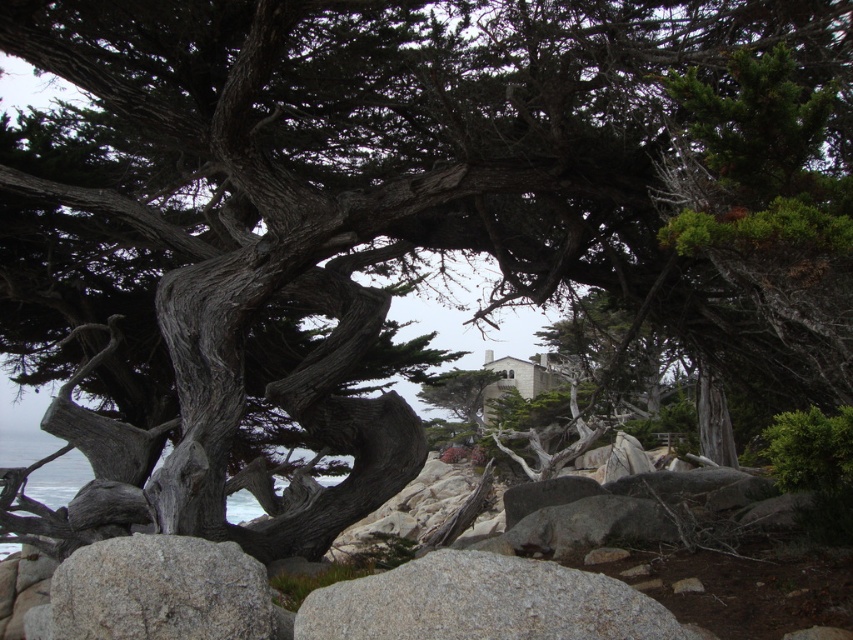
You are a hiker carrying a backpack that is 24 inches wide. You need to cross between the gray granite boulder at lower center and the gray rough rock at lower left. Can your backpack fit through the gap between them?

The distance between the gray granite boulder at lower center and the gray rough rock at lower left is 24.06 inches, so your 24 inch wide backpack can fit through the gap since it is slightly narrower than the space available.

You are a hiker trying to cross a rocky path. You see the gray granite boulder at lower center and the gray rough rock at lower left. Which one is shorter in height?

The gray granite boulder at lower center is shorter in height compared to the gray rough rock at lower left.

You are a hiker carrying a heavy backpack and want to rest on a rock. Which rock would you choose between the gray granite boulder at lower center and the gray rough rock at lower left if you prefer a larger surface area to sit on?

The gray granite boulder at lower center has a larger size compared to the gray rough rock at lower left, so you should choose the gray granite boulder at lower center for a larger surface area to sit on.